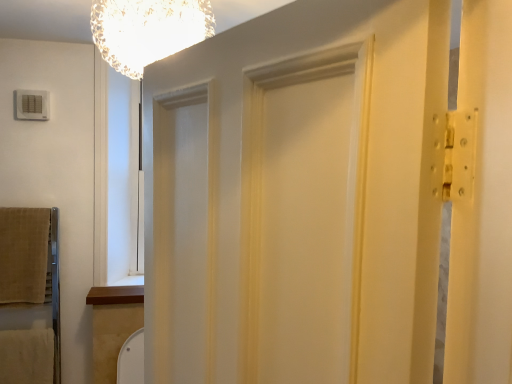
Question: Can you confirm if white painted wood barn door at center is taller than beige soft towel at left?

Choices:
 (A) yes
 (B) no

Answer: (A)

Question: Is beige soft towel at left at the back of white painted wood barn door at center?

Choices:
 (A) yes
 (B) no

Answer: (B)

Question: From a real-world perspective, is white painted wood barn door at center positioned over beige soft towel at left based on gravity?

Choices:
 (A) no
 (B) yes

Answer: (B)

Question: From a real-world perspective, is white painted wood barn door at center physically below beige soft towel at left?

Choices:
 (A) no
 (B) yes

Answer: (A)

Question: Does white painted wood barn door at center have a greater width compared to beige soft towel at left?

Choices:
 (A) yes
 (B) no

Answer: (A)

Question: Is white painted wood barn door at center behind beige soft towel at left?

Choices:
 (A) no
 (B) yes

Answer: (A)

Question: Are white painted wood barn door at center and translucent glass chandelier at upper center making contact?

Choices:
 (A) yes
 (B) no

Answer: (B)

Question: Is white painted wood barn door at center not near translucent glass chandelier at upper center?

Choices:
 (A) no
 (B) yes

Answer: (A)

Question: Can you confirm if white painted wood barn door at center is wider than translucent glass chandelier at upper center?

Choices:
 (A) no
 (B) yes

Answer: (A)

Question: From the image's perspective, is white painted wood barn door at center under translucent glass chandelier at upper center?

Choices:
 (A) no
 (B) yes

Answer: (B)

Question: Considering the relative sizes of white painted wood barn door at center and translucent glass chandelier at upper center in the image provided, is white painted wood barn door at center shorter than translucent glass chandelier at upper center?

Choices:
 (A) no
 (B) yes

Answer: (A)

Question: From the image's perspective, is white painted wood barn door at center above translucent glass chandelier at upper center?

Choices:
 (A) no
 (B) yes

Answer: (A)

Question: From a real-world perspective, is translucent glass chandelier at upper center below white painted wood barn door at center?

Choices:
 (A) no
 (B) yes

Answer: (A)